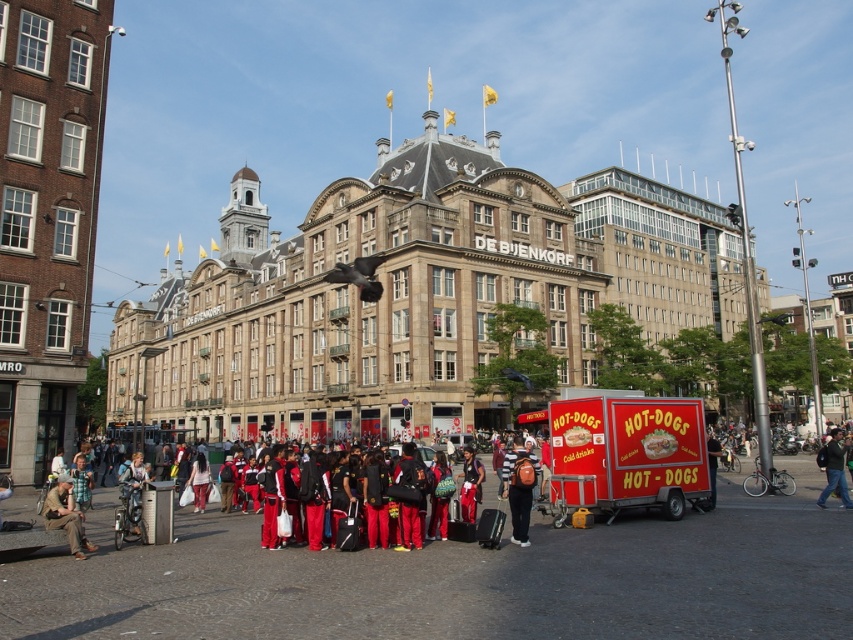
Who is higher up, brown leather backpack at lower center or leather jacket at lower left?

leather jacket at lower left

Is brown leather backpack at lower center above leather jacket at lower left?

No, brown leather backpack at lower center is not above leather jacket at lower left.

I want to click on brown leather backpack at lower center, so click(519, 488).

Can you confirm if dark green jacket at center is positioned to the right of red fabric pants at lower center?

Indeed, dark green jacket at center is positioned on the right side of red fabric pants at lower center.

Does point (834, 467) come in front of point (459, 492)?

Yes, point (834, 467) is closer to viewer.

Is point (830, 451) behind point (469, 449)?

No.

This screenshot has width=853, height=640. What are the coordinates of `dark green jacket at center` in the screenshot? It's located at (834, 472).

Does red painted trailer at lower right have a greater height compared to brown leather backpack at lower center?

Indeed, red painted trailer at lower right has a greater height compared to brown leather backpack at lower center.

Where is `red painted trailer at lower right`? The height and width of the screenshot is (640, 853). red painted trailer at lower right is located at coordinates (625, 452).